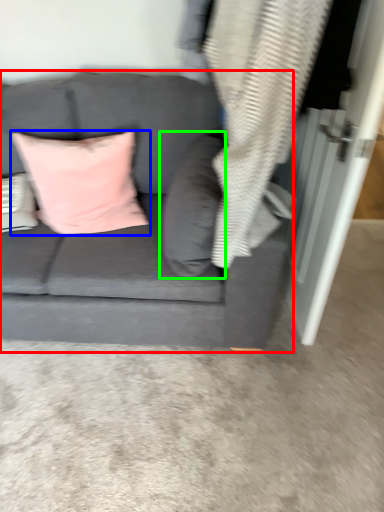
Question: Estimate the real-world distances between objects in this image. Which object is farther from studio couch (highlighted by a red box), pillow (highlighted by a blue box) or pillow (highlighted by a green box)?

Choices:
 (A) pillow
 (B) pillow

Answer: (A)